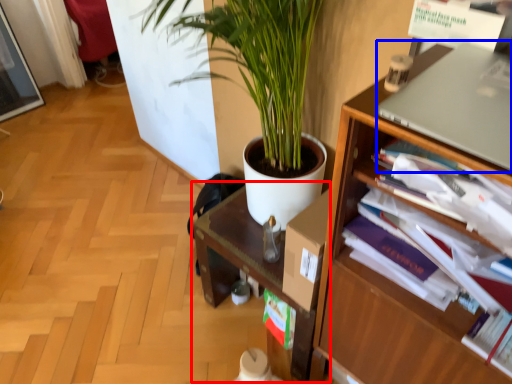
Question: Among these objects, which one is farthest to the camera, computer desk (highlighted by a red box) or computer (highlighted by a blue box)?

Choices:
 (A) computer desk
 (B) computer

Answer: (A)